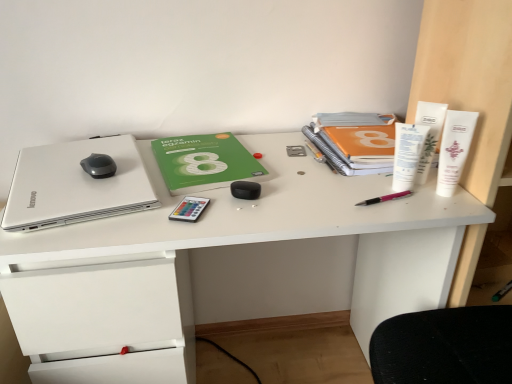
Question: From a real-world perspective, does white plastic tube at upper right, which is the fifth stationery in left-to-right order, stand above green matte paperback book at center, which appears as the 1th paperback book when viewed from the left?

Choices:
 (A) yes
 (B) no

Answer: (A)

Question: Is white plastic tube at upper right, which is the fifth stationery in left-to-right order, taller than green matte paperback book at center, which is the second paperback book in right-to-left order?

Choices:
 (A) no
 (B) yes

Answer: (B)

Question: Is white plastic tube at upper right, placed as the first stationery when sorted from right to left, facing away from green matte paperback book at center, which appears as the 1th paperback book when viewed from the left?

Choices:
 (A) yes
 (B) no

Answer: (B)

Question: Is white plastic tube at upper right, placed as the first stationery when sorted from right to left, outside green matte paperback book at center, which is the second paperback book in right-to-left order?

Choices:
 (A) no
 (B) yes

Answer: (B)

Question: Is white plastic tube at upper right, which is the fifth stationery in left-to-right order, shorter than green matte paperback book at center, which appears as the 1th paperback book when viewed from the left?

Choices:
 (A) no
 (B) yes

Answer: (A)

Question: From the image's perspective, relative to black rubberized mouse at upper left, is white plastic tube at upper right, which ranks as the 4th stationery in left-to-right order, above or below?

Choices:
 (A) below
 (B) above

Answer: (B)

Question: Is white plastic tube at upper right, which ranks as the 4th stationery in left-to-right order, taller or shorter than black rubberized mouse at upper left?

Choices:
 (A) short
 (B) tall

Answer: (B)

Question: Considering the relative positions of white plastic tube at upper right, the 2th stationery positioned from the right, and black rubberized mouse at upper left in the image provided, is white plastic tube at upper right, the 2th stationery positioned from the right, to the left or to the right of black rubberized mouse at upper left?

Choices:
 (A) left
 (B) right

Answer: (B)

Question: From a real-world perspective, relative to black rubberized mouse at upper left, is white plastic tube at upper right, the 2th stationery positioned from the right, vertically above or below?

Choices:
 (A) above
 (B) below

Answer: (A)

Question: In terms of height, does green matte paperback book at center, which is the second paperback book in right-to-left order, look taller or shorter compared to white plastic tube at upper right, the 2th stationery positioned from the right?

Choices:
 (A) short
 (B) tall

Answer: (A)

Question: Is point (181, 157) closer or farther from the camera than point (423, 163)?

Choices:
 (A) farther
 (B) closer

Answer: (A)

Question: Is green matte paperback book at center, which is the second paperback book in right-to-left order, bigger or smaller than white plastic tube at upper right, the 2th stationery positioned from the right?

Choices:
 (A) big
 (B) small

Answer: (A)

Question: In terms of width, does green matte paperback book at center, which is the second paperback book in right-to-left order, look wider or thinner when compared to white plastic tube at upper right, which ranks as the 4th stationery in left-to-right order?

Choices:
 (A) thin
 (B) wide

Answer: (B)

Question: From their relative heights in the image, would you say orange matte notebook at upper right, which is the 2th paperback book in left-to-right order, is taller or shorter than green matte paperback book at center, which is the second paperback book in right-to-left order?

Choices:
 (A) short
 (B) tall

Answer: (B)

Question: Considering the positions of orange matte notebook at upper right, acting as the 1th paperback book starting from the right, and green matte paperback book at center, which appears as the 1th paperback book when viewed from the left, in the image, is orange matte notebook at upper right, acting as the 1th paperback book starting from the right, wider or thinner than green matte paperback book at center, which appears as the 1th paperback book when viewed from the left,?

Choices:
 (A) thin
 (B) wide

Answer: (B)